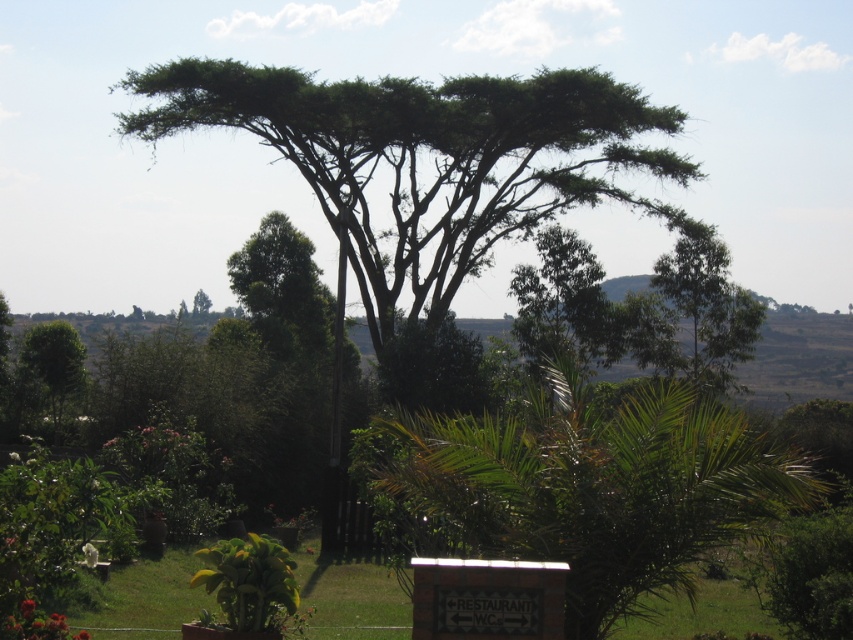
You are standing at the point marked by the coordinates point (585, 486) in the image. Looking around, you see the large acacia tree with a sprawling canopy and the small potted plant with broad leaves in the lower left corner. What object is located at your current position?

The point (585, 486) indicates the green leafy palm at center, so you are standing at the green leafy palm at center.

You are planning to place a new bench in this outdoor area. The bench requires a space that is at least as large as the green leafy palm at center. Can the area near the green leafy tree at upper center accommodate the bench?

The green leafy palm at center has a larger size compared to the green leafy tree at upper center. Therefore, the area near the green leafy tree at upper center may not be large enough to accommodate the bench since the tree itself is smaller than the palm.

You are standing at the center of the lawn and want to place a new bench. The bench needs to be positioned exactly at the coordinates where the green leafy palm at center is located. Can you confirm the exact coordinates for placing the bench?

The green leafy palm at center is located at point (x=585, y=486), so the bench should be placed at those coordinates.